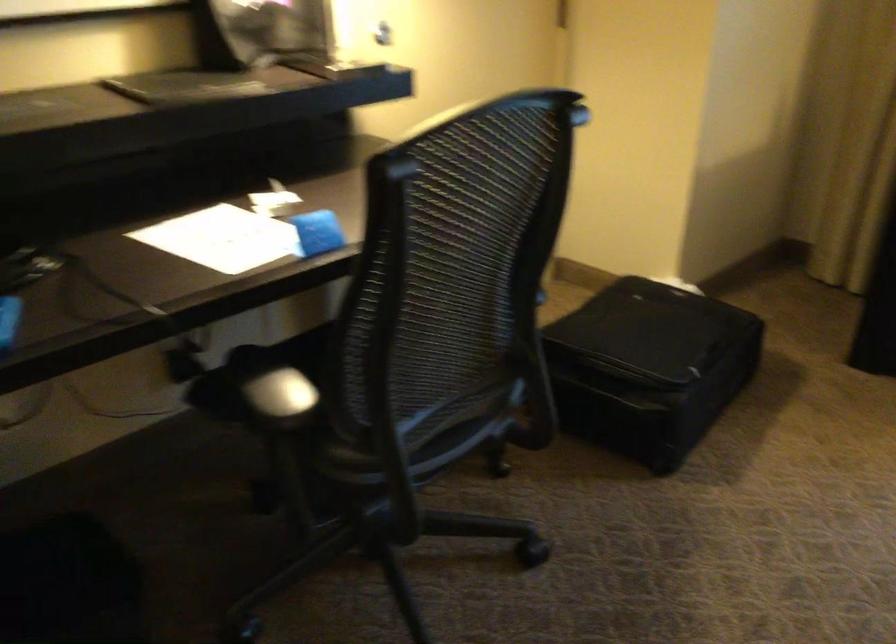
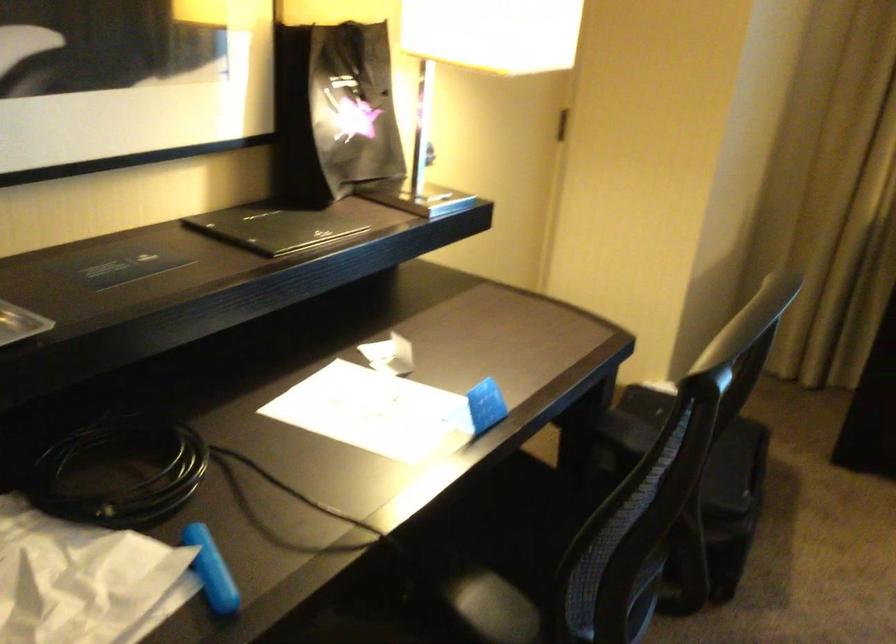
Question: Based on the continuous images, in which direction is the camera rotating? Reply with the corresponding letter.

Choices:
 (A) Left
 (B) Right
 (C) Up
 (D) Down

Answer: (B)